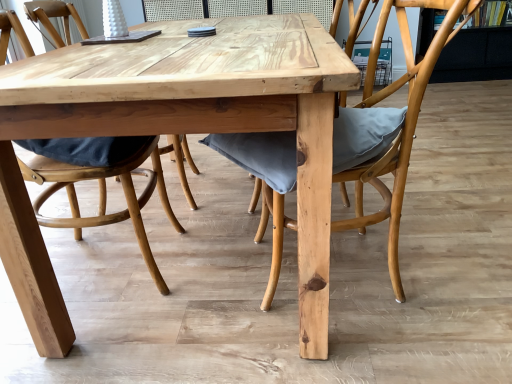
This screenshot has width=512, height=384. I want to click on vacant space in natural wood table at center (from a real-world perspective), so click(x=207, y=220).